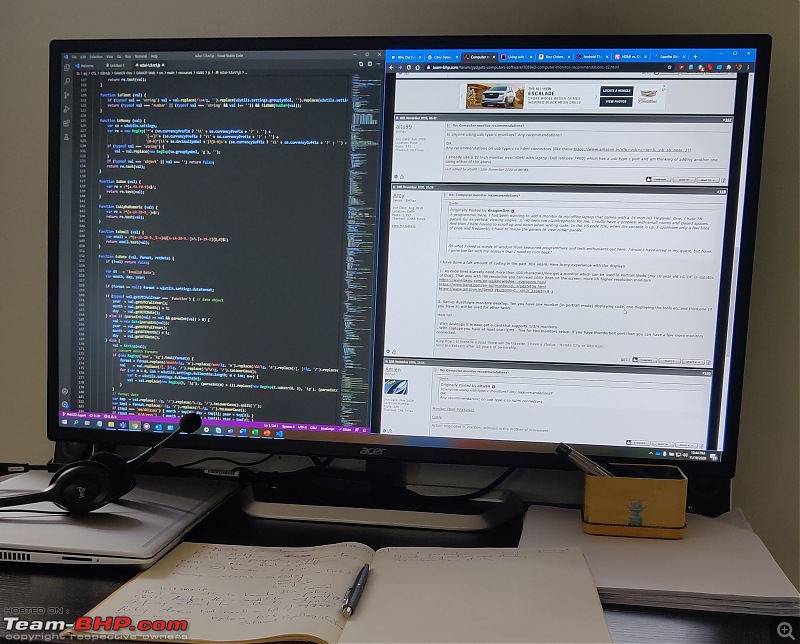
You are a GUI agent. You are given a task and a screenshot of the screen. Output one action in this format:
    pyautogui.click(x=<x>, y=<y>)
    Task: Click on the computer screen
    This screenshot has height=644, width=800.
    Given the screenshot: What is the action you would take?
    pyautogui.click(x=410, y=187)